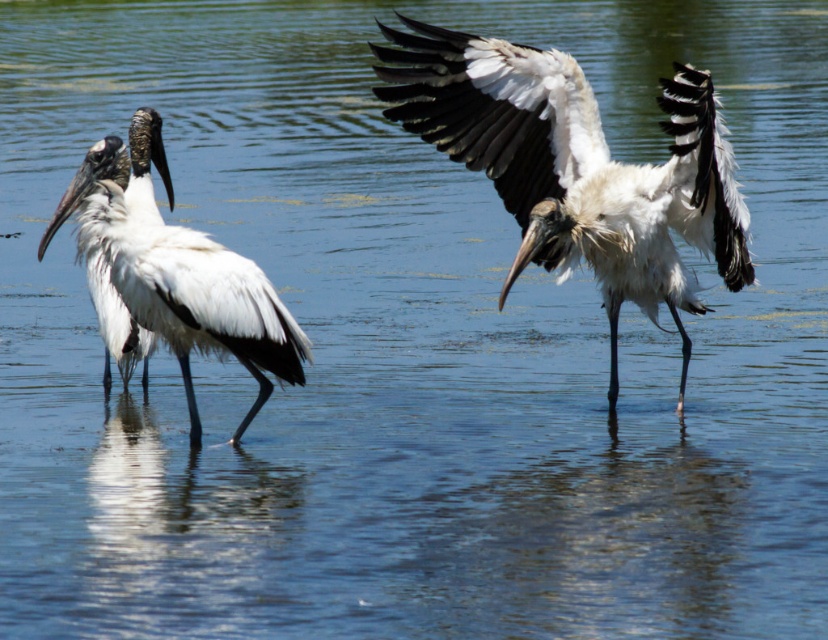
Question: Which of the following is the closest to the observer?

Choices:
 (A) (472, 154)
 (B) (153, 312)

Answer: (B)

Question: Among these objects, which one is nearest to the camera?

Choices:
 (A) white matte bird at center
 (B) white matte bird at left

Answer: (A)

Question: Does white matte bird at center appear under white matte bird at left?

Choices:
 (A) yes
 (B) no

Answer: (B)

Question: Is white matte bird at center closer to the viewer compared to white matte bird at left?

Choices:
 (A) yes
 (B) no

Answer: (A)

Question: Can you confirm if white matte bird at center is wider than white matte bird at left?

Choices:
 (A) yes
 (B) no

Answer: (A)